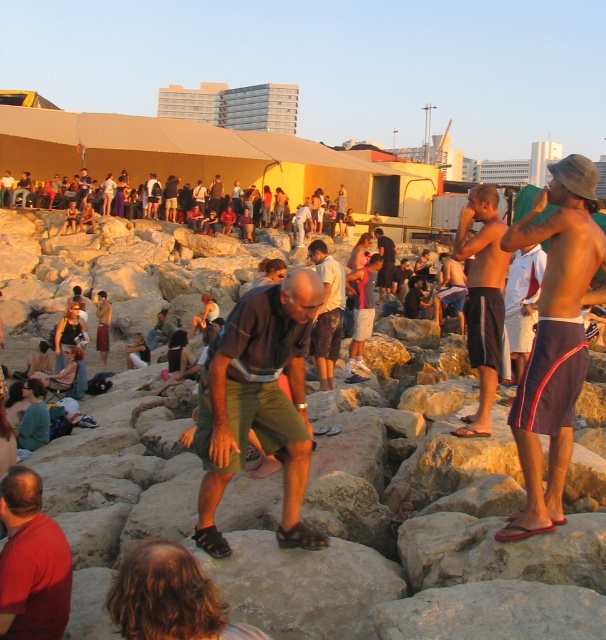
Based on the photo, is dark green shorts at center above dark blue shirt at center?

Actually, dark green shorts at center is below dark blue shirt at center.

Looking at this image, who is more distant from viewer, (315, 280) or (385, 241)?

Point (385, 241)

The width and height of the screenshot is (606, 640). Identify the location of dark green shorts at center. (258, 403).

Between red matte shirt at lower left and dark blue shorts at center, which one is positioned lower?

Positioned lower is red matte shirt at lower left.

Between point (18, 536) and point (488, 349), which one is positioned behind?

The point (488, 349) is behind.

Locate an element on the screen. This screenshot has height=640, width=606. red matte shirt at lower left is located at coordinates (32, 561).

Who is taller, dark green shorts at center or matte yellow tent at upper center?

With more height is matte yellow tent at upper center.

Image resolution: width=606 pixels, height=640 pixels. What do you see at coordinates (258, 403) in the screenshot?
I see `dark green shorts at center` at bounding box center [258, 403].

Identify the location of dark green shorts at center. The width and height of the screenshot is (606, 640). (258, 403).